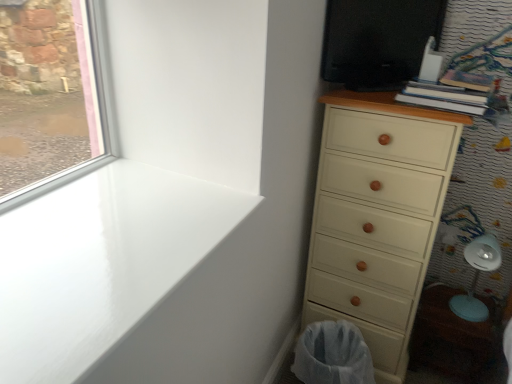
Question: Would you say white mesh laundry basket at lower right is outside white plastic swivel chair at lower right?

Choices:
 (A) no
 (B) yes

Answer: (B)

Question: Would you say white mesh laundry basket at lower right is a long distance from white plastic swivel chair at lower right?

Choices:
 (A) no
 (B) yes

Answer: (A)

Question: Is white mesh laundry basket at lower right placed right next to white plastic swivel chair at lower right?

Choices:
 (A) no
 (B) yes

Answer: (A)

Question: Does white mesh laundry basket at lower right have a larger size compared to white plastic swivel chair at lower right?

Choices:
 (A) yes
 (B) no

Answer: (A)

Question: Is white mesh laundry basket at lower right oriented away from white plastic swivel chair at lower right?

Choices:
 (A) yes
 (B) no

Answer: (B)

Question: Is white mesh laundry basket at lower right positioned in front of white plastic swivel chair at lower right?

Choices:
 (A) no
 (B) yes

Answer: (B)

Question: Is white glossy window sill at upper left closer to the viewer compared to white plastic swivel chair at lower right?

Choices:
 (A) yes
 (B) no

Answer: (A)

Question: From the image's perspective, would you say white glossy window sill at upper left is shown under white plastic swivel chair at lower right?

Choices:
 (A) yes
 (B) no

Answer: (B)

Question: Is white glossy window sill at upper left oriented towards white plastic swivel chair at lower right?

Choices:
 (A) yes
 (B) no

Answer: (B)

Question: Can you confirm if white glossy window sill at upper left is shorter than white plastic swivel chair at lower right?

Choices:
 (A) yes
 (B) no

Answer: (A)

Question: Would you say white glossy window sill at upper left contains white plastic swivel chair at lower right?

Choices:
 (A) no
 (B) yes

Answer: (A)

Question: Is white glossy window sill at upper left at the left side of white plastic swivel chair at lower right?

Choices:
 (A) yes
 (B) no

Answer: (A)

Question: Could you tell me if white glossy window sill at upper left is facing black glossy screen door at upper right?

Choices:
 (A) no
 (B) yes

Answer: (A)